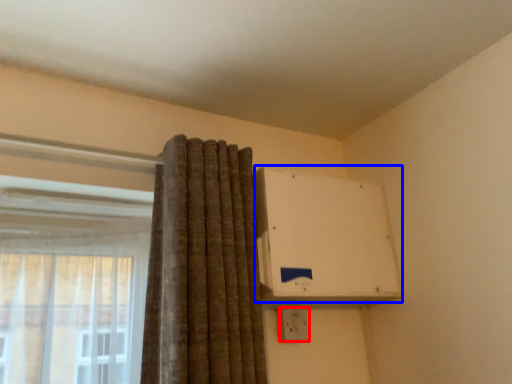
Question: Among these objects, which one is farthest to the camera, electric outlet (highlighted by a red box) or air conditioning (highlighted by a blue box)?

Choices:
 (A) electric outlet
 (B) air conditioning

Answer: (A)